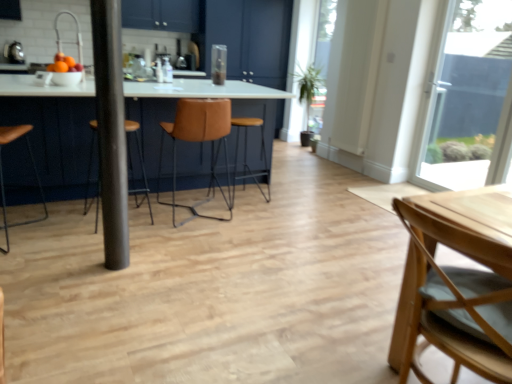
Question: Considering the relative sizes of transparent glass window at upper right and leather seat at center in the image provided, is transparent glass window at upper right taller than leather seat at center?

Choices:
 (A) no
 (B) yes

Answer: (B)

Question: Is transparent glass window at upper right behind leather seat at center?

Choices:
 (A) no
 (B) yes

Answer: (A)

Question: From the image's perspective, is transparent glass window at upper right located above leather seat at center?

Choices:
 (A) no
 (B) yes

Answer: (B)

Question: Does transparent glass window at upper right lie in front of leather seat at center?

Choices:
 (A) yes
 (B) no

Answer: (A)

Question: From a real-world perspective, is transparent glass window at upper right over leather seat at center?

Choices:
 (A) no
 (B) yes

Answer: (B)

Question: Is transparent glass window at upper right beside leather seat at center?

Choices:
 (A) no
 (B) yes

Answer: (A)

Question: Is leather seat at center oriented towards shiny orange fruits at left?

Choices:
 (A) yes
 (B) no

Answer: (B)

Question: Is leather seat at center located outside shiny orange fruits at left?

Choices:
 (A) no
 (B) yes

Answer: (B)

Question: Considering the relative sizes of leather seat at center and shiny orange fruits at left in the image provided, is leather seat at center wider than shiny orange fruits at left?

Choices:
 (A) yes
 (B) no

Answer: (A)

Question: Does leather seat at center come behind shiny orange fruits at left?

Choices:
 (A) no
 (B) yes

Answer: (B)

Question: Is leather seat at center facing away from shiny orange fruits at left?

Choices:
 (A) yes
 (B) no

Answer: (B)

Question: From the image's perspective, is leather seat at center located above shiny orange fruits at left?

Choices:
 (A) yes
 (B) no

Answer: (B)

Question: Does leather seat at center contain metallic silver toaster at upper left?

Choices:
 (A) no
 (B) yes

Answer: (A)